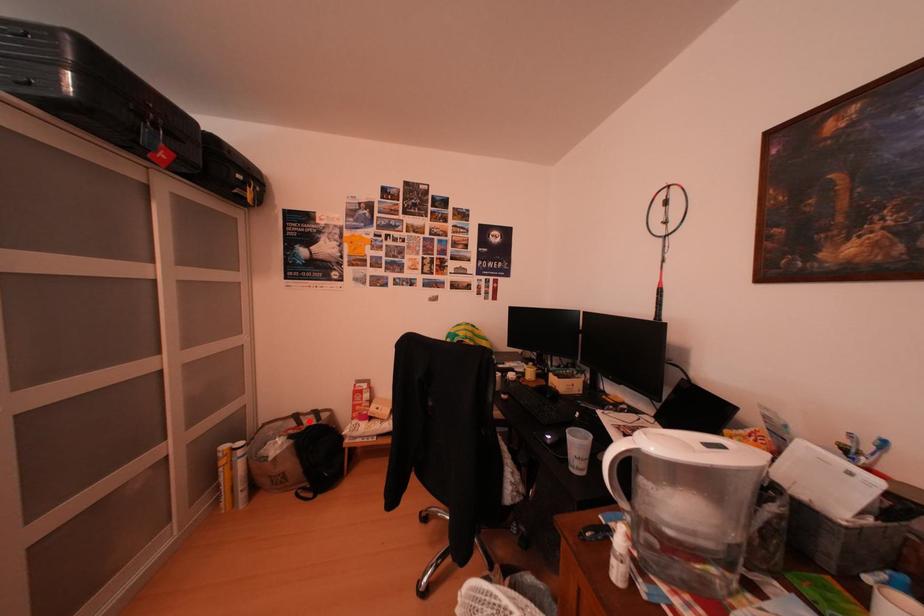
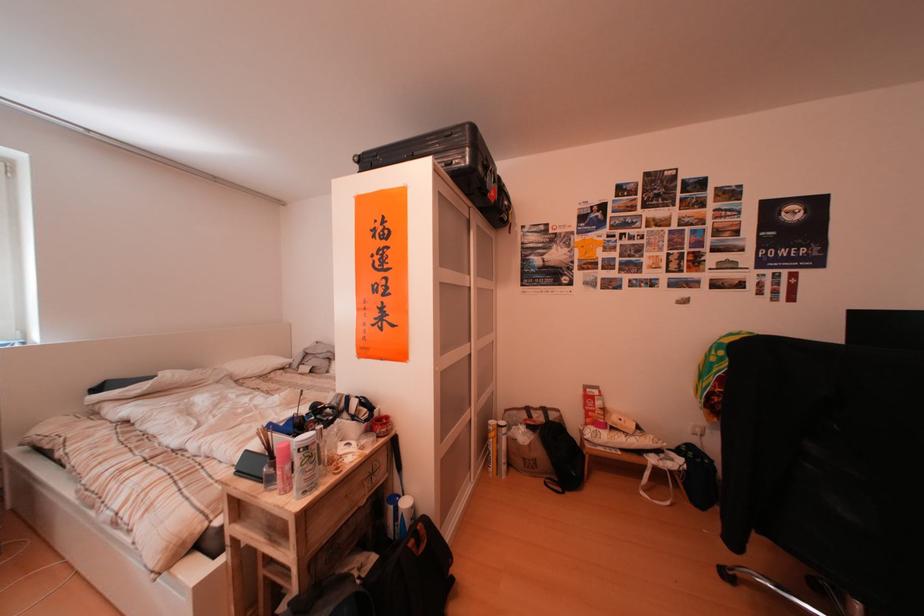
Find the pixel in the second image that matches the highlighted location in the first image.

(541, 415)